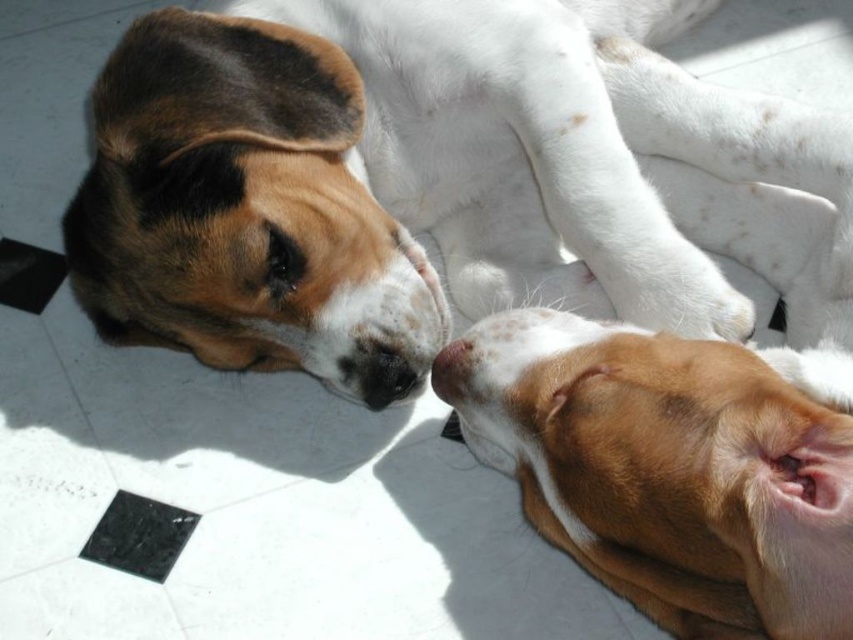
Question: Estimate the real-world distances between objects in this image. Which object is closer to the brown matte nose at lower center?

Choices:
 (A) brown and white fur at upper left
 (B) brown soft fur at lower right

Answer: (B)

Question: Can you confirm if brown soft fur at lower right is positioned below brown matte nose at lower center?

Choices:
 (A) yes
 (B) no

Answer: (A)

Question: Which point is closer to the camera?

Choices:
 (A) brown and white fur at upper left
 (B) brown soft fur at lower right
 (C) brown matte nose at lower center

Answer: (B)

Question: Does brown soft fur at lower right appear under brown matte nose at lower center?

Choices:
 (A) yes
 (B) no

Answer: (A)

Question: Based on their relative distances, which object is nearer to the brown matte nose at lower center?

Choices:
 (A) brown soft fur at lower right
 (B) brown and white fur at upper left

Answer: (A)

Question: In this image, where is brown and white fur at upper left located relative to brown matte nose at lower center?

Choices:
 (A) right
 (B) left

Answer: (A)